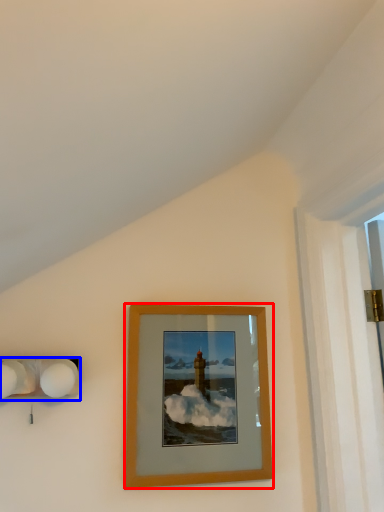
Question: Among these objects, which one is nearest to the camera, picture frame (highlighted by a red box) or lamp (highlighted by a blue box)?

Choices:
 (A) picture frame
 (B) lamp

Answer: (B)